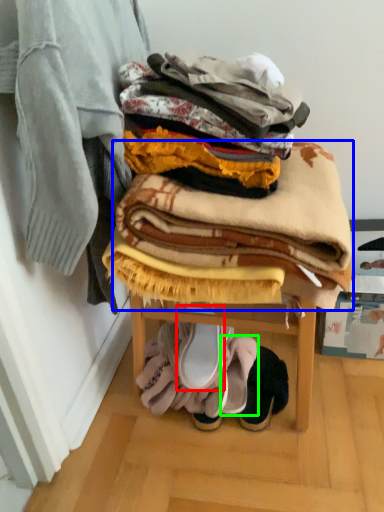
Question: Which object is positioned farthest from footwear (highlighted by a red box)? Select from blanket (highlighted by a blue box) and footwear (highlighted by a green box).

Choices:
 (A) blanket
 (B) footwear

Answer: (A)